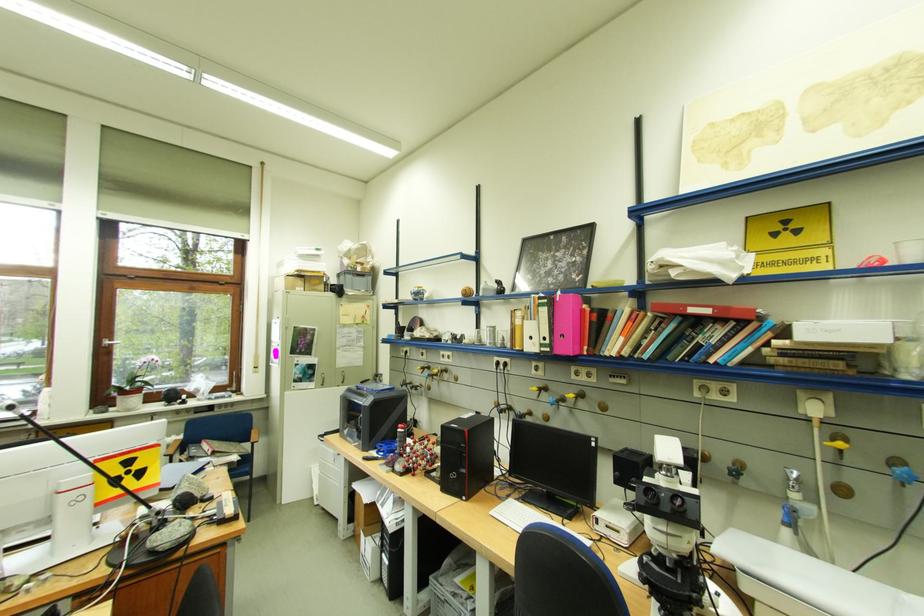
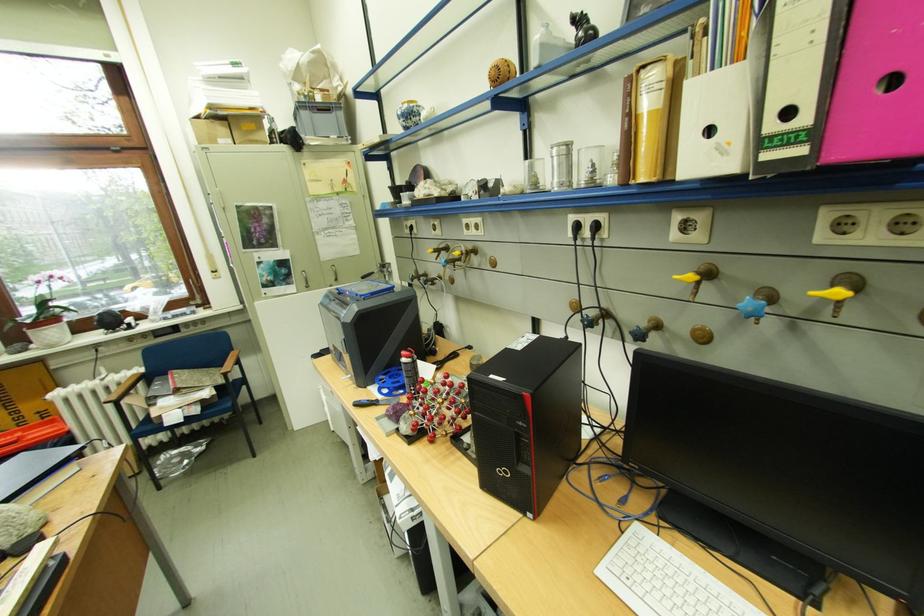
Find the pixel in the second image that matches point 505,464 in the first image.

(593, 421)